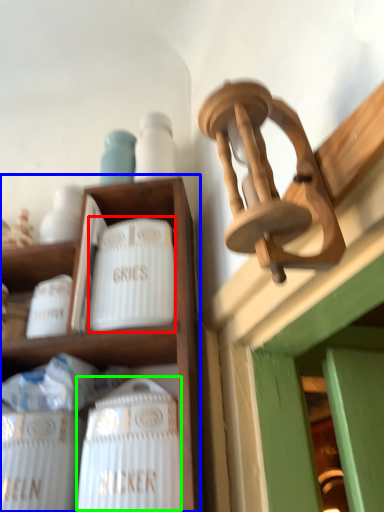
Question: Considering the real-world distances, which object is farthest from pottery (highlighted by a red box)? shelf (highlighted by a blue box) or wine bottle (highlighted by a green box)?

Choices:
 (A) shelf
 (B) wine bottle

Answer: (B)